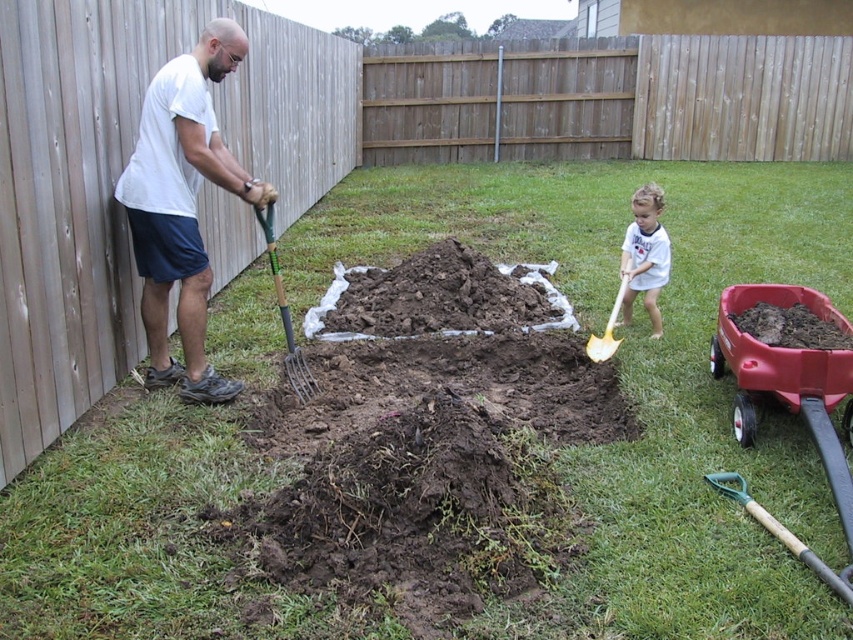
Between white matte shirt at left and dark brown soil at center, which one has less height?

Standing shorter between the two is dark brown soil at center.

Can you confirm if white matte shirt at left is bigger than dark brown soil at center?

No, white matte shirt at left is not bigger than dark brown soil at center.

Image resolution: width=853 pixels, height=640 pixels. What do you see at coordinates (183, 205) in the screenshot?
I see `white matte shirt at left` at bounding box center [183, 205].

Where is `white matte shirt at left`? white matte shirt at left is located at coordinates (183, 205).

Between white matte shirt at left and dark brown soil at lower right, which one has more height?

white matte shirt at left is taller.

Where is `white matte shirt at left`? Image resolution: width=853 pixels, height=640 pixels. white matte shirt at left is located at coordinates (183, 205).

Identify the location of white matte shirt at left. (183, 205).

Does red plastic wagon at right appear over white cotton shirt at upper right?

Actually, red plastic wagon at right is below white cotton shirt at upper right.

Is red plastic wagon at right to the right of white cotton shirt at upper right from the viewer's perspective?

Yes, red plastic wagon at right is to the right of white cotton shirt at upper right.

Describe the element at coordinates (780, 348) in the screenshot. The height and width of the screenshot is (640, 853). I see `red plastic wagon at right` at that location.

Where is `red plastic wagon at right`? The height and width of the screenshot is (640, 853). red plastic wagon at right is located at coordinates (780, 348).